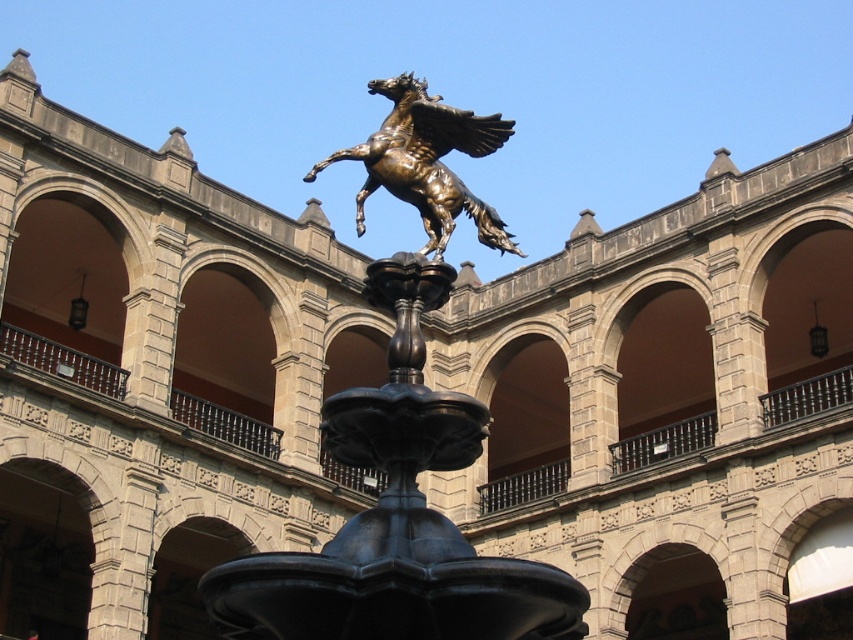
You are an architect designing a new courtyard and want to ensure the black polished fountain at center is visible from the entrance. The entrance is located behind the brown stone archway at center. Considering their heights, will the fountain block the view of the archway from the entrance?

The black polished fountain at center is taller than the brown stone archway at center, so it will block the view of the archway from the entrance.